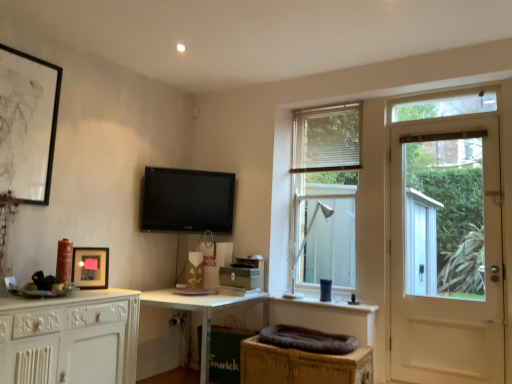
Question: Is white wooden door at right taller or shorter than white metal table lamp at center?

Choices:
 (A) tall
 (B) short

Answer: (A)

Question: From a real-world perspective, relative to white metal table lamp at center, is white wooden door at right vertically above or below?

Choices:
 (A) below
 (B) above

Answer: (B)

Question: Which object is positioned closest to the matte black picture frame at left, marked as the 1th picture frame in a right-to-left arrangement?

Choices:
 (A) brown wicker basket at lower center, marked as the second cabinetry in a left-to-right arrangement
 (B) white wooden door at right
 (C) black glossy tv at upper center
 (D) white wood window at center
 (E) white glossy desk at center

Answer: (E)

Question: Estimate the real-world distances between objects in this image. Which object is farther from the white wood window at center?

Choices:
 (A) white matte cabinet at lower left, which appears as the first cabinetry when viewed from the left
 (B) white glossy desk at center
 (C) matte black picture frame at upper left, the second picture frame when ordered from bottom to top
 (D) brown wicker basket at lower center, marked as the second cabinetry in a left-to-right arrangement
 (E) white metal table lamp at center

Answer: (C)